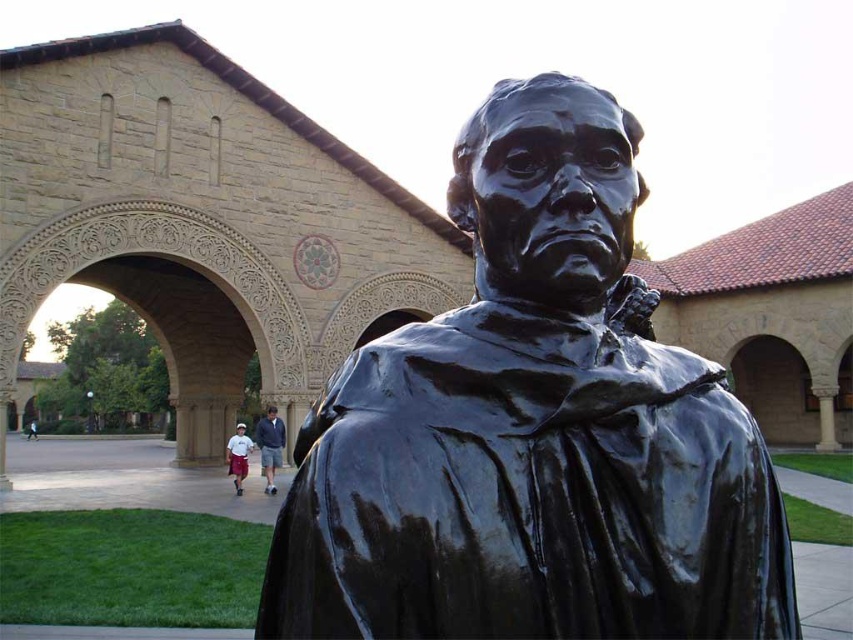
You are a fashion designer observing a model wearing light blue denim shorts at lower center and white cotton shorts at lower left. Which shorts have a larger size?

The white cotton shorts at lower left have a larger size compared to the light blue denim shorts at lower center.

You are a photographer standing in the scene and want to capture both the glossy bronze statue at center and the white cotton shorts at lower left in the same frame. However, your camera has a limited depth of field. Which object should you focus on to ensure both are in focus?

You should focus on the glossy bronze statue at center because it is positioned over the white cotton shorts at lower left, meaning it is closer to the camera. By focusing on the closer object, both will be in focus due to the overlapping depth of field.

You are a photographer trying to capture both the glossy bronze statue at center and the white cotton shorts at lower left in the same frame. Which object should you focus on first if you want to ensure both are in focus?

The glossy bronze statue at center is shorter than the white cotton shorts at lower left, so you should focus on the white cotton shorts at lower left first to ensure both are in focus.